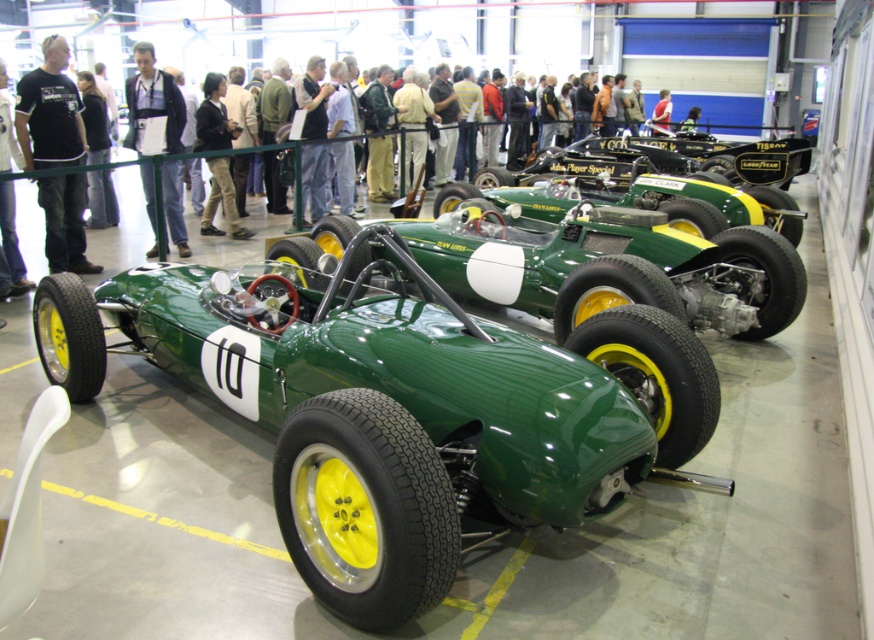
Consider the image. You are a visitor at the car exhibition and you see the green matte sports car at center and the black fabric jacket at upper left. Which object is shorter in height?

The green matte sports car at center is shorter in height compared to the black fabric jacket at upper left.

You are standing in front of the vintage racing car exhibition and want to take a photo of both the green racing car with yellow wheels and the white number 10 on its side and another car in the background. You notice two points marked as point (99,204) and point (3,170) on your camera screen. Which point is closer to you?

Point (3,170) is closer to you because the description states that point (99,204) is further to the viewer than point (3,170).

Consider the image. You are a photographer planning to capture a wide shot of the green matte sports car at center and the black fabric jacket at upper left. Given that your camera can only accommodate objects within a 2 meter width limit, will both items fit side by side in the frame?

The green matte sports car at center is wider than the black fabric jacket at upper left. Since the camera can only accommodate a 2 meter width limit, and the total width of both items combined exceeds this limit, they cannot fit side by side in the frame.